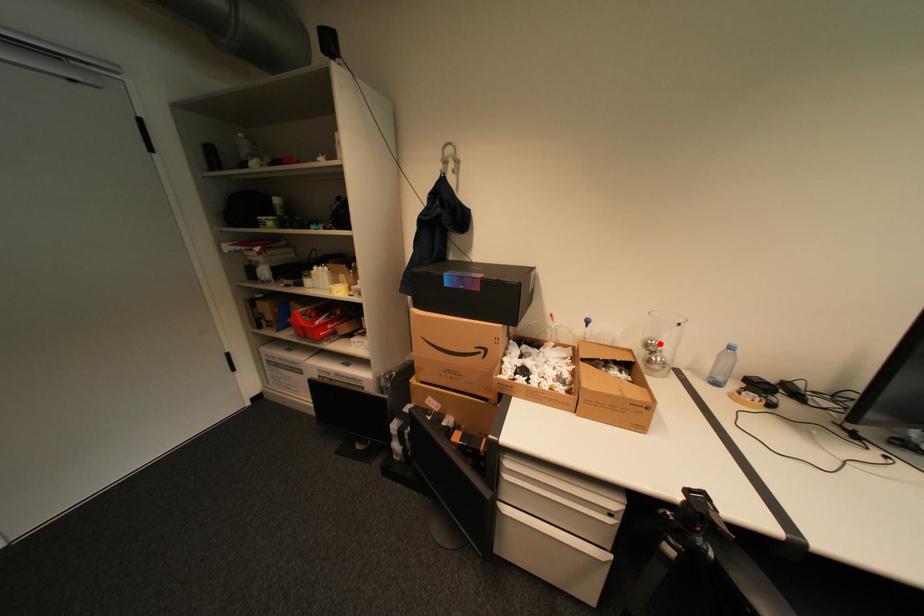
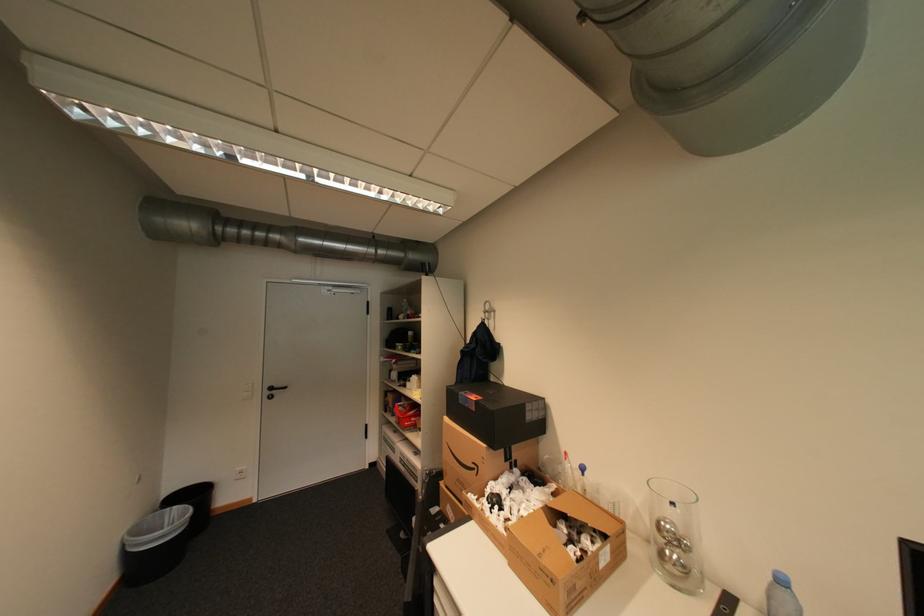
In the second image, find the point that corresponds to the highlighted location in the first image.

(673, 527)